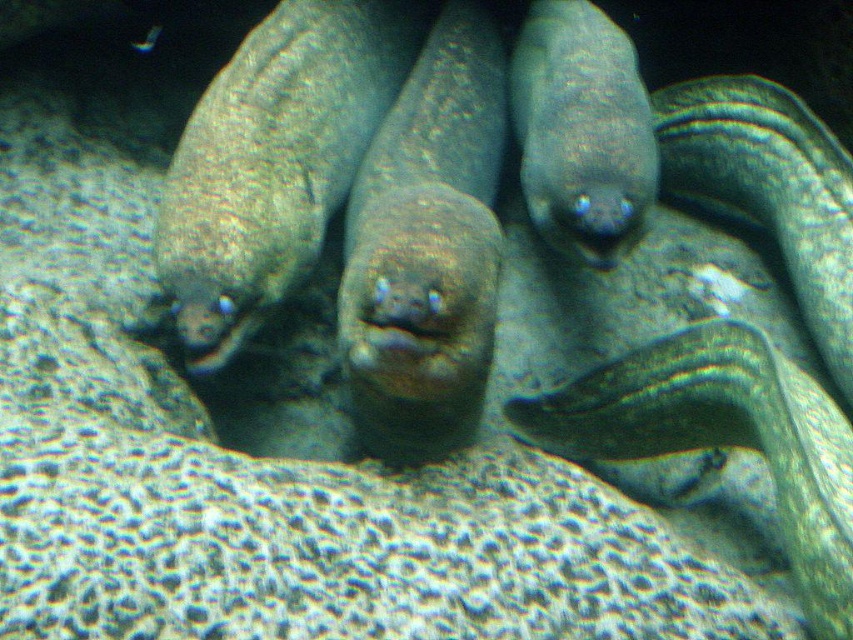
You are a scuba diver observing the underwater scene. You see the shiny brown eel at center and the slick green eel at center. Which eel would appear larger to you?

The shiny brown eel at center appears larger because it is closer to the viewer than the slick green eel at center.

You are a marine biologist observing underwater. You need to locate the green striped eel at center. According to the coordinates provided, where would you find it in the image?

The green striped eel at center is located at the 2D coordinates point (723,436) in the image.